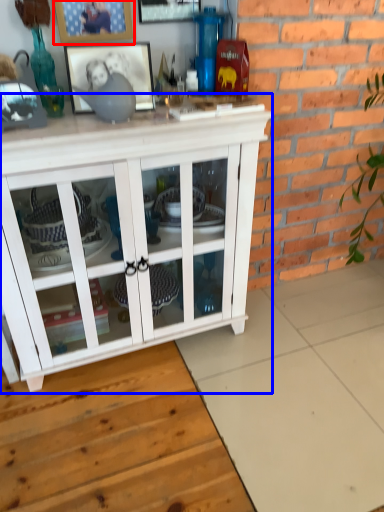
Question: Among these objects, which one is nearest to the camera, picture frame (highlighted by a red box) or cabinetry (highlighted by a blue box)?

Choices:
 (A) picture frame
 (B) cabinetry

Answer: (B)